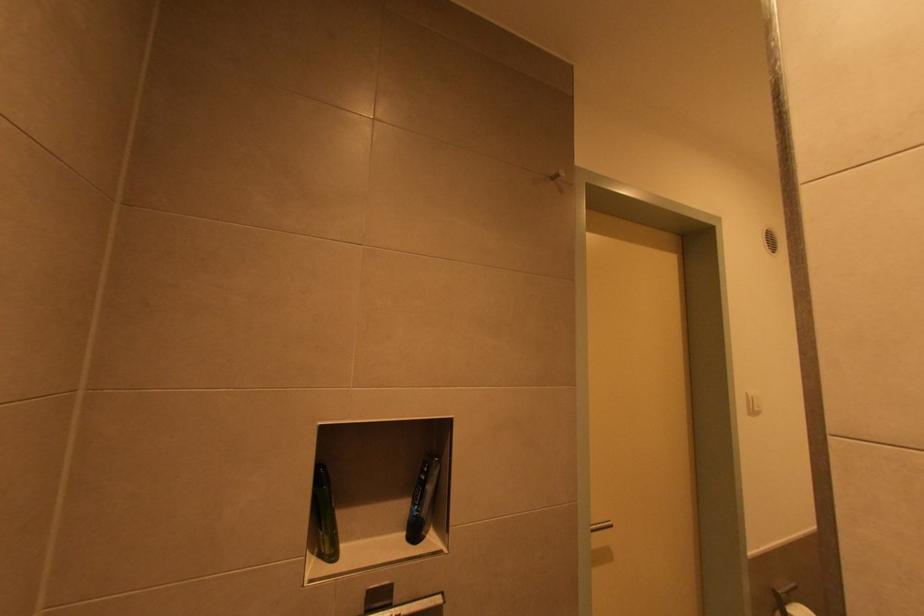
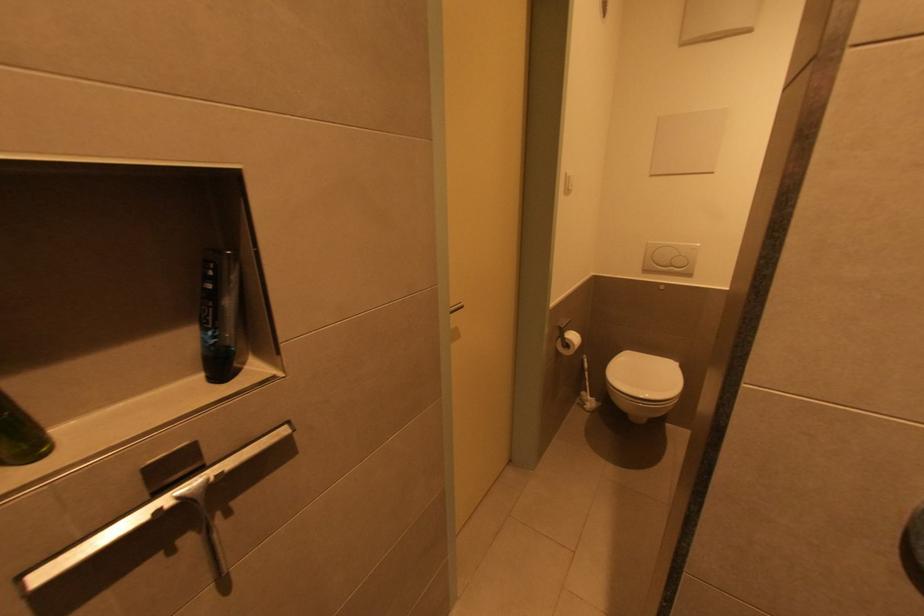
The first image is from the beginning of the video and the second image is from the end. How did the camera likely rotate when shooting the video?

The camera rotated toward right-down.